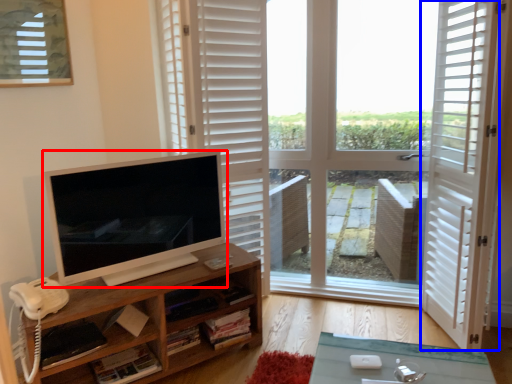
Question: Which point is further to the camera, computer monitor (highlighted by a red box) or screen door (highlighted by a blue box)?

Choices:
 (A) computer monitor
 (B) screen door

Answer: (A)